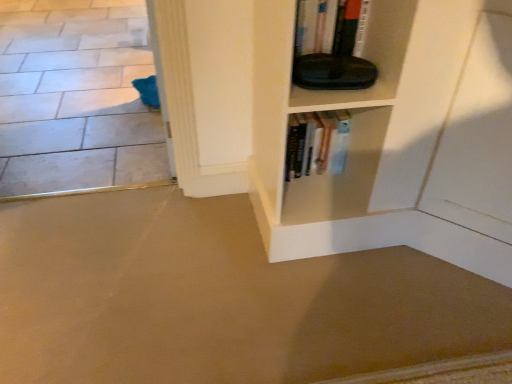
Question: Is beige carpet at lower left, the first concrete when ordered from front to back, not within white tile floor at lower left, which appears as the first concrete when viewed from the back?

Choices:
 (A) yes
 (B) no

Answer: (A)

Question: Is beige carpet at lower left, which appears as the 1th concrete when ordered from the bottom, facing away from white tile floor at lower left, which is the second concrete in front-to-back order?

Choices:
 (A) yes
 (B) no

Answer: (B)

Question: Is white tile floor at lower left, which is the second concrete in bottom-to-top order, located within beige carpet at lower left, marked as the second concrete in a back-to-front arrangement?

Choices:
 (A) no
 (B) yes

Answer: (A)

Question: Is beige carpet at lower left, which appears as the 1th concrete when ordered from the bottom, bigger than white tile floor at lower left, placed as the 1th concrete when sorted from top to bottom?

Choices:
 (A) no
 (B) yes

Answer: (A)

Question: Is beige carpet at lower left, acting as the 2th concrete starting from the top, taller than white tile floor at lower left, which appears as the first concrete when viewed from the back?

Choices:
 (A) no
 (B) yes

Answer: (A)

Question: Is beige carpet at lower left, which appears as the 1th concrete when ordered from the bottom, aimed at white tile floor at lower left, which is the second concrete in front-to-back order?

Choices:
 (A) yes
 (B) no

Answer: (A)

Question: Does hardcover books at center have a greater height compared to beige carpet at lower left, the first concrete when ordered from front to back?

Choices:
 (A) no
 (B) yes

Answer: (B)

Question: Does hardcover books at center come behind beige carpet at lower left, the first concrete when ordered from front to back?

Choices:
 (A) yes
 (B) no

Answer: (A)

Question: Would you say hardcover books at center is a long distance from beige carpet at lower left, marked as the second concrete in a back-to-front arrangement?

Choices:
 (A) no
 (B) yes

Answer: (A)

Question: From a real-world perspective, is hardcover books at center beneath beige carpet at lower left, acting as the 2th concrete starting from the top?

Choices:
 (A) no
 (B) yes

Answer: (A)

Question: Considering the relative sizes of hardcover books at center and beige carpet at lower left, acting as the 2th concrete starting from the top, in the image provided, is hardcover books at center wider than beige carpet at lower left, acting as the 2th concrete starting from the top,?

Choices:
 (A) yes
 (B) no

Answer: (B)

Question: Considering the relative positions of hardcover books at center and beige carpet at lower left, which appears as the 1th concrete when ordered from the bottom, in the image provided, is hardcover books at center to the left of beige carpet at lower left, which appears as the 1th concrete when ordered from the bottom, from the viewer's perspective?

Choices:
 (A) yes
 (B) no

Answer: (B)

Question: Is beige carpet at lower left, the first concrete when ordered from front to back, directly adjacent to hardcover books at center?

Choices:
 (A) yes
 (B) no

Answer: (B)